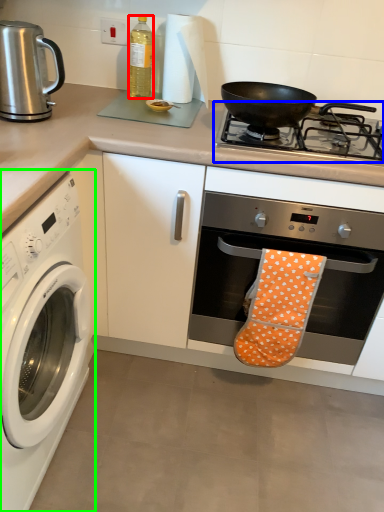
Question: Based on their relative distances, which object is farther from bottle (highlighted by a red box)? Choose from gas stove (highlighted by a blue box) and washing machine (highlighted by a green box).

Choices:
 (A) gas stove
 (B) washing machine

Answer: (B)